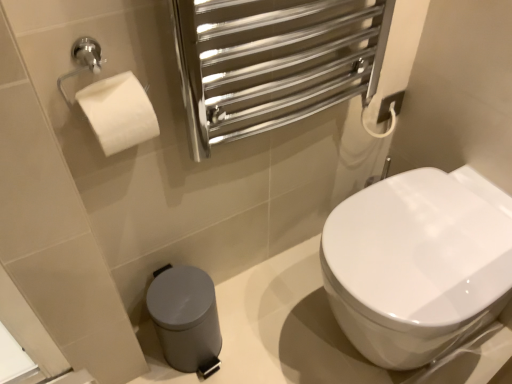
Question: Is white glossy toilet at center spatially inside satin grey plastic trash can at lower left, or outside of it?

Choices:
 (A) outside
 (B) inside

Answer: (A)

Question: Looking at their shapes, would you say white glossy toilet at center is wider or thinner than satin grey plastic trash can at lower left?

Choices:
 (A) thin
 (B) wide

Answer: (B)

Question: Is point click(x=456, y=246) positioned closer to the camera than point click(x=209, y=279)?

Choices:
 (A) farther
 (B) closer

Answer: (B)

Question: From a real-world perspective, is satin grey plastic trash can at lower left positioned above or below white glossy toilet at center?

Choices:
 (A) above
 (B) below

Answer: (B)

Question: From the image's perspective, is satin grey plastic trash can at lower left above or below white glossy toilet at center?

Choices:
 (A) below
 (B) above

Answer: (A)

Question: Considering the positions of satin grey plastic trash can at lower left and white glossy toilet at center in the image, is satin grey plastic trash can at lower left bigger or smaller than white glossy toilet at center?

Choices:
 (A) small
 (B) big

Answer: (A)

Question: Is point coord(179,296) positioned closer to the camera than point coord(415,301)?

Choices:
 (A) farther
 (B) closer

Answer: (A)